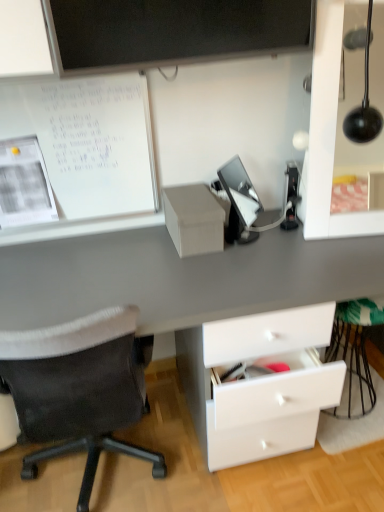
Question: Is matte black lamp at upper right at the back of matte cardboard box at center?

Choices:
 (A) yes
 (B) no

Answer: (B)

Question: From the image's perspective, is matte cardboard box at center on matte black lamp at upper right?

Choices:
 (A) no
 (B) yes

Answer: (A)

Question: Can you see matte cardboard box at center touching matte black lamp at upper right?

Choices:
 (A) yes
 (B) no

Answer: (B)

Question: Can you confirm if matte cardboard box at center is shorter than matte black lamp at upper right?

Choices:
 (A) no
 (B) yes

Answer: (B)

Question: Does matte cardboard box at center appear on the right side of matte black lamp at upper right?

Choices:
 (A) no
 (B) yes

Answer: (A)

Question: From the image's perspective, relative to matte cardboard box at center, is white matte paperboard at upper left above or below?

Choices:
 (A) below
 (B) above

Answer: (B)

Question: Looking at their shapes, would you say white matte paperboard at upper left is wider or thinner than matte cardboard box at center?

Choices:
 (A) thin
 (B) wide

Answer: (A)

Question: Is point (112, 188) closer or farther from the camera than point (173, 203)?

Choices:
 (A) farther
 (B) closer

Answer: (A)

Question: Is white matte paperboard at upper left situated inside matte cardboard box at center or outside?

Choices:
 (A) outside
 (B) inside

Answer: (A)

Question: Considering their positions, is matte black lamp at upper right located in front of or behind matte cardboard box at center?

Choices:
 (A) front
 (B) behind

Answer: (A)

Question: From the image's perspective, is matte black lamp at upper right located above or below matte cardboard box at center?

Choices:
 (A) below
 (B) above

Answer: (B)

Question: Which is correct: matte black lamp at upper right is inside matte cardboard box at center, or outside of it?

Choices:
 (A) inside
 (B) outside

Answer: (B)

Question: Is matte black lamp at upper right to the left or to the right of matte cardboard box at center in the image?

Choices:
 (A) right
 (B) left

Answer: (A)

Question: From the image's perspective, is matte cardboard box at center above or below white matte paperboard at upper left?

Choices:
 (A) below
 (B) above

Answer: (A)

Question: Relative to white matte paperboard at upper left, is matte cardboard box at center in front or behind?

Choices:
 (A) behind
 (B) front

Answer: (A)